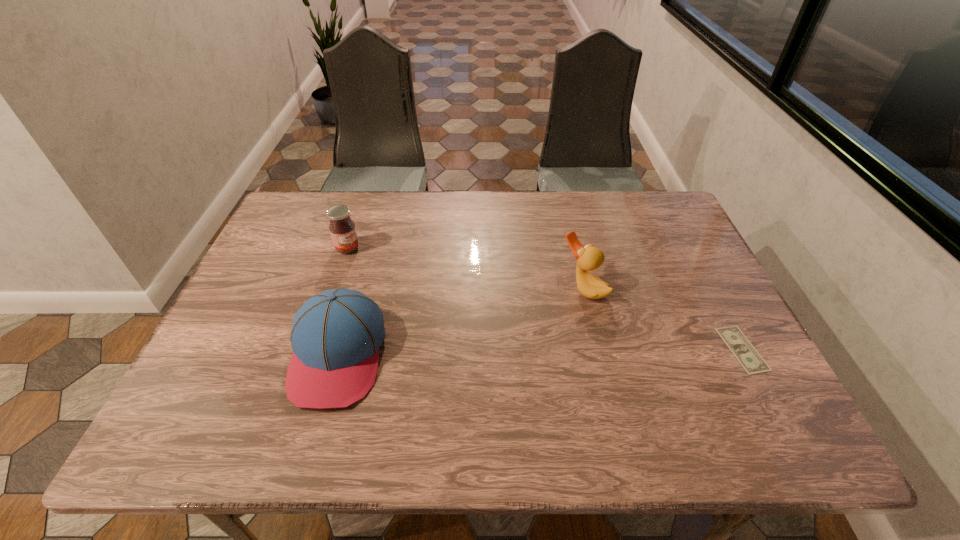
This screenshot has height=540, width=960. I want to click on vacant spot on the desktop that is between the baseball cap and the money and is positioned on the label side of the farthest object, so click(517, 353).

Image resolution: width=960 pixels, height=540 pixels. In order to click on free space on the desktop that is between the baseball cap and the money and is positioned on the beak of the third nearest object in this screenshot , I will do `click(487, 353)`.